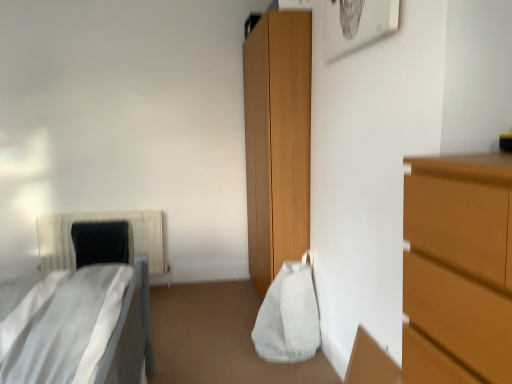
Find the location of a particular element. black fabric pillow at left is located at coordinates (100, 242).

You are a GUI agent. You are given a task and a screenshot of the screen. Output one action in this format:
    pyautogui.click(x=<x>, y=<y>)
    Task: Click on the white textured radiator at left
    
    Given the screenshot: What is the action you would take?
    pyautogui.click(x=100, y=220)

The width and height of the screenshot is (512, 384). What are the coordinates of `black fabric pillow at left` in the screenshot? It's located at (100, 242).

Would you say white fabric bag at center is to the left or to the right of white textured radiator at left in the picture?

white fabric bag at center is to the right of white textured radiator at left.

Is white fabric bag at center taller or shorter than white textured radiator at left?

white fabric bag at center is shorter than white textured radiator at left.

From the image's perspective, would you say white fabric bag at center is shown under white textured radiator at left?

Correct, white fabric bag at center appears lower than white textured radiator at left in the image.

From a real-world perspective, is white fabric bag at center positioned above or below white textured radiator at left?

From a real-world perspective, white fabric bag at center is physically below white textured radiator at left.

In the scene shown: Considering the relative sizes of white textured radiator at left and white fabric bag at center in the image provided, is white textured radiator at left taller than white fabric bag at center?

Correct, white textured radiator at left is much taller as white fabric bag at center.

Considering the sizes of white textured radiator at left and white fabric bag at center in the image, is white textured radiator at left wider or thinner than white fabric bag at center?

Clearly, white textured radiator at left has less width compared to white fabric bag at center.

Based on the photo, would you say white textured radiator at left is inside or outside white fabric bag at center?

The correct answer is: outside.

Consider the image. Is white fabric bag at center wider or thinner than black fabric pillow at left?

In the image, white fabric bag at center appears to be wider than black fabric pillow at left.

In terms of height, does white fabric bag at center look taller or shorter compared to black fabric pillow at left?

Clearly, white fabric bag at center is taller compared to black fabric pillow at left.

Is white fabric bag at center inside or outside of black fabric pillow at left?

white fabric bag at center is not inside black fabric pillow at left, it's outside.

Considering the relative positions of black fabric pillow at left and white textured radiator at left in the image provided, is black fabric pillow at left to the right of white textured radiator at left from the viewer's perspective?

Yes.

From the image's perspective, which is above, black fabric pillow at left or white textured radiator at left?

black fabric pillow at left.

Can you confirm if black fabric pillow at left is wider than white textured radiator at left?

No.

Which object is thinner, white fabric bed at left or white fabric bag at center?

Thinner between the two is white fabric bag at center.

Are white fabric bed at left and white fabric bag at center far apart?

No.

Considering the positions of objects white fabric bed at left and white fabric bag at center in the image provided, who is in front, white fabric bed at left or white fabric bag at center?

white fabric bed at left.

Is white fabric bed at left positioned with its back to white fabric bag at center?

No, white fabric bag at center is not at the back of white fabric bed at left.

Is white fabric bag at center placed right next to white fabric bed at left?

No, white fabric bag at center is not with white fabric bed at left.

Is point (282, 336) closer or farther from the camera than point (67, 378)?

Point (282, 336) is farther from the camera than point (67, 378).

Which of these two, white fabric bag at center or white fabric bed at left, is thinner?

white fabric bag at center is thinner.

From a real-world perspective, is black fabric pillow at left located beneath white fabric bed at left?

Yes, from a real-world perspective, black fabric pillow at left is under white fabric bed at left.

Is black fabric pillow at left oriented away from white fabric bed at left?

black fabric pillow at left is not turned away from white fabric bed at left.

Visually, is black fabric pillow at left positioned to the left or to the right of white fabric bed at left?

In the image, black fabric pillow at left appears on the left side of white fabric bed at left.

In order to click on bag beneath the white textured radiator at left (from a real-world perspective) in this screenshot , I will do `click(289, 315)`.

Identify the location of radiator lying above the white fabric bag at center (from the image's perspective). (100, 220).

When comparing their distances from white fabric bed at left, does white fabric bag at center or black fabric pillow at left seem closer?

white fabric bag at center.

Estimate the real-world distances between objects in this image. Which object is further from white fabric bed at left, black fabric pillow at left or white textured radiator at left?

Based on the image, white textured radiator at left appears to be further to white fabric bed at left.

Looking at the image, which one is located further to black fabric pillow at left, white fabric bed at left or white fabric bag at center?

white fabric bag at center lies further to black fabric pillow at left than the other object.

Looking at this image, which object lies further to the anchor point white fabric bag at center, white textured radiator at left or white fabric bed at left?

white textured radiator at left lies further to white fabric bag at center than the other object.

Estimate the real-world distances between objects in this image. Which object is closer to white textured radiator at left, black fabric pillow at left or white fabric bag at center?

Among the two, black fabric pillow at left is located nearer to white textured radiator at left.

Estimate the real-world distances between objects in this image. Which object is closer to white fabric bed at left, black fabric pillow at left or white fabric bag at center?

white fabric bag at center is positioned closer to the anchor white fabric bed at left.

Estimate the real-world distances between objects in this image. Which object is closer to white fabric bed at left, white fabric bag at center or white textured radiator at left?

white fabric bag at center lies closer to white fabric bed at left than the other object.

From the image, which object appears to be farther from white textured radiator at left, white fabric bed at left or black fabric pillow at left?

white fabric bed at left is further to white textured radiator at left.

The width and height of the screenshot is (512, 384). What are the coordinates of `pillow between white fabric bed at left and white textured radiator at left from front to back` in the screenshot? It's located at [100, 242].

Where is `bag between white fabric bed at left and white textured radiator at left from front to back`? This screenshot has height=384, width=512. bag between white fabric bed at left and white textured radiator at left from front to back is located at coordinates (289, 315).

Locate an element on the screen. This screenshot has height=384, width=512. bag between white fabric bed at left and black fabric pillow at left along the z-axis is located at coordinates (289, 315).

Identify the location of pillow between white textured radiator at left and white fabric bag at center. This screenshot has height=384, width=512. (100, 242).